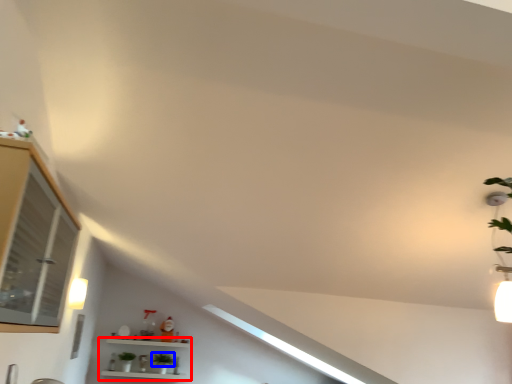
Question: Which object appears farthest to the camera in this image, shelf (highlighted by a red box) or plant (highlighted by a blue box)?

Choices:
 (A) shelf
 (B) plant

Answer: (B)